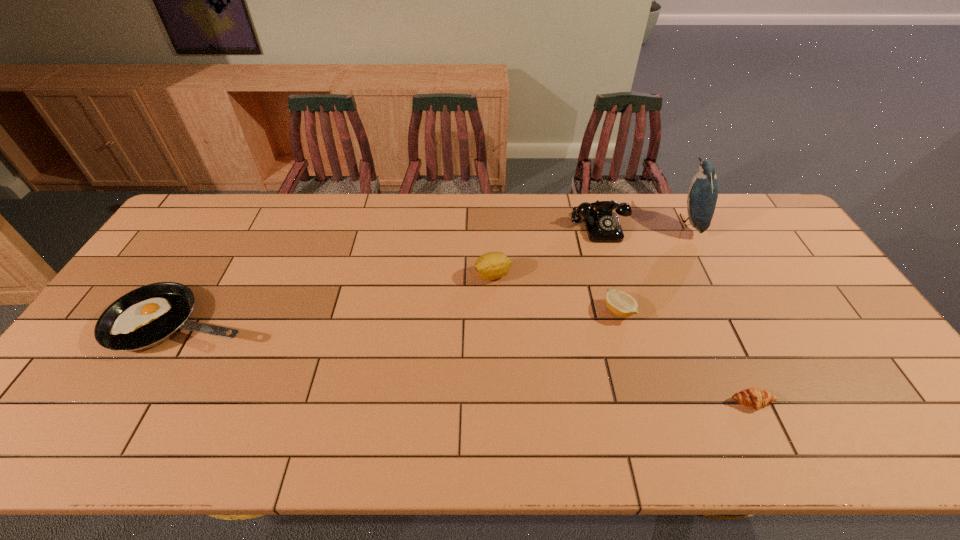
At what (x,y) coordinates should I click in order to perform the action: click on vacant point that satisfies the following two spatial constraints: 1. at the tip of the tallest object's beak; 2. on the front-facing side of the shortest object. Please return your answer as a coordinate pair (x, y). Looking at the image, I should click on (782, 402).

Image resolution: width=960 pixels, height=540 pixels. In order to click on vacant area that satisfies the following two spatial constraints: 1. at the tip of the tallest object's beak; 2. on the front-facing side of the pastry in this screenshot , I will do `click(782, 402)`.

The width and height of the screenshot is (960, 540). Find the location of `free space that satisfies the following two spatial constraints: 1. at the tip of the bird's beak; 2. on the front-facing side of the nearest object`. free space that satisfies the following two spatial constraints: 1. at the tip of the bird's beak; 2. on the front-facing side of the nearest object is located at coordinates (782, 402).

The image size is (960, 540). In order to click on vacant area that satisfies the following two spatial constraints: 1. on the dial of the telephone; 2. at the stem end of the fifth object from right to left in this screenshot , I will do `click(614, 275)`.